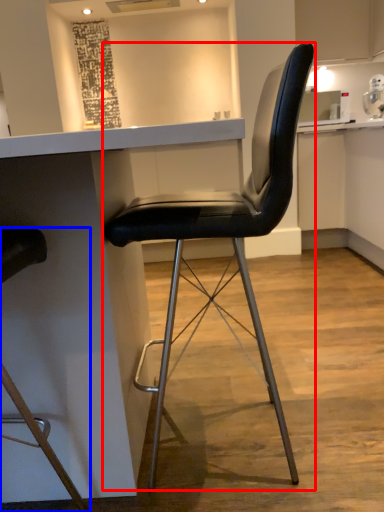
Question: Which point is closer to the camera, chair (highlighted by a red box) or chair (highlighted by a blue box)?

Choices:
 (A) chair
 (B) chair

Answer: (B)